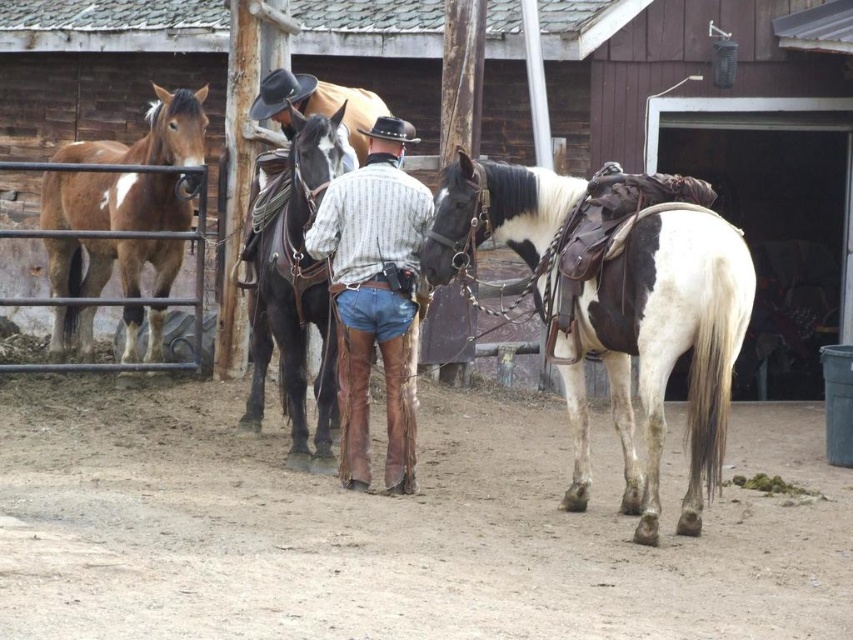
You are a photographer setting up a tripod to take a photo of the brown glossy horse at left and the leather cowboy hat at center. Based on their sizes, which object should you focus on first if you want to ensure both are in frame without moving the tripod?

The brown glossy horse at left is taller than the leather cowboy hat at center, so you should focus on the brown glossy horse at left first to ensure the entire height of both objects fits within the frame.